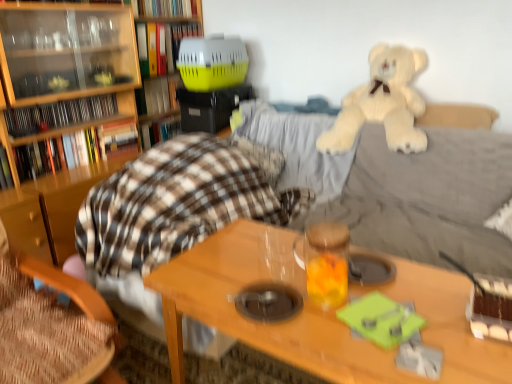
This screenshot has height=384, width=512. Find the location of `vacant space that is to the left of translucent glass jar at center`. vacant space that is to the left of translucent glass jar at center is located at coordinates point(269,288).